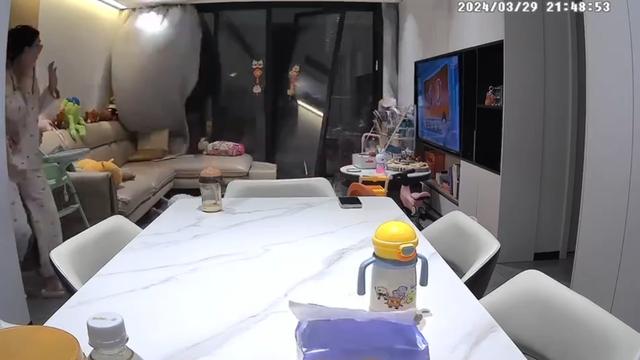
Where is `chair`? chair is located at coordinates (464, 241), (553, 336), (76, 244).